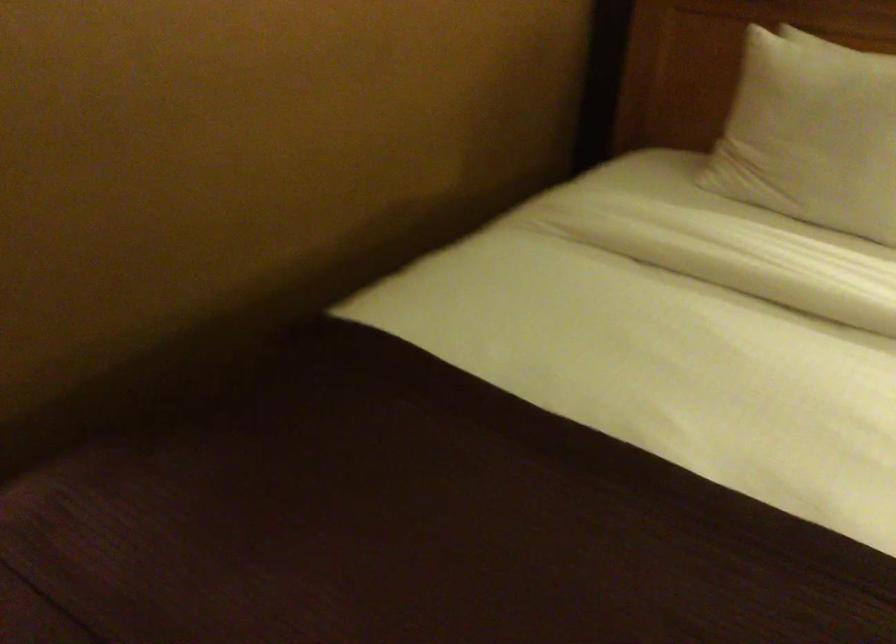
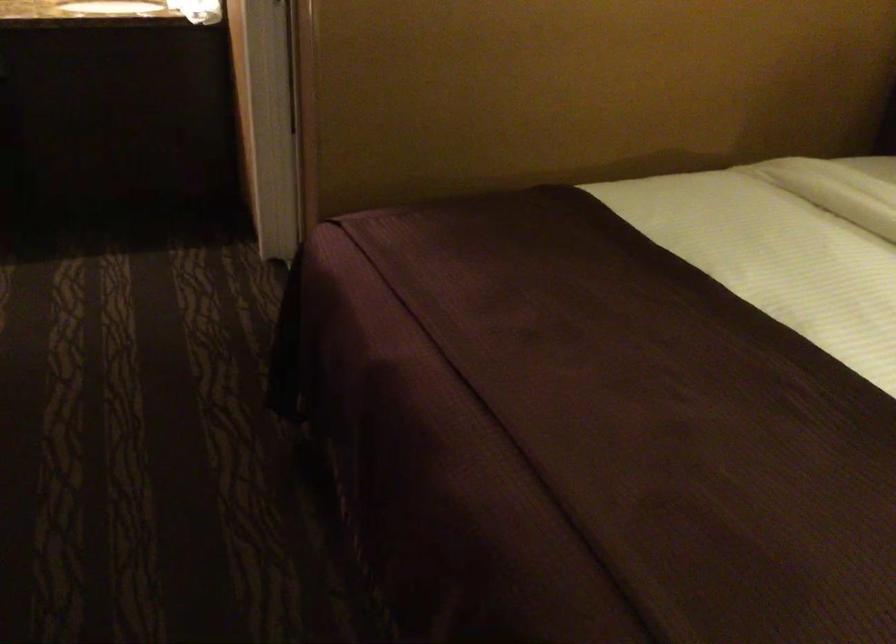
Question: The camera is either moving clockwise (left) or counter-clockwise (right) around the object. The first image is from the beginning of the video and the second image is from the end. Is the camera moving left or right when shooting the video?

Choices:
 (A) Left
 (B) Right

Answer: (B)